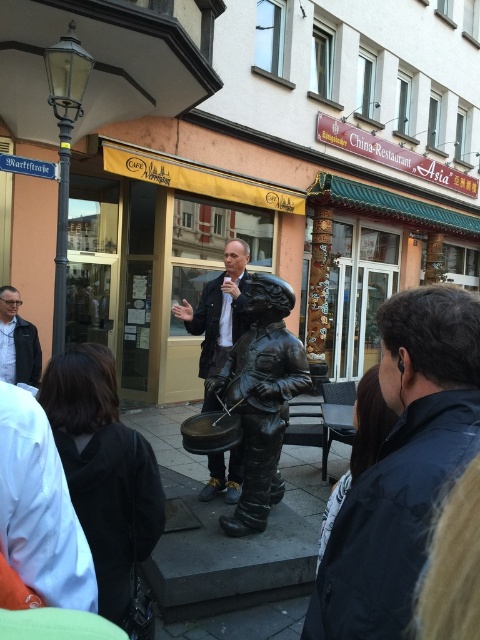
Question: Can you confirm if black fabric at lower left is positioned above matte black jacket at left?

Choices:
 (A) yes
 (B) no

Answer: (B)

Question: Which object is the closest to the black fabric at lower left?

Choices:
 (A) matte black jacket at left
 (B) black stone statue at center
 (C) bronze statue at center

Answer: (B)

Question: Is black fabric at lower left above bronze statue at center?

Choices:
 (A) no
 (B) yes

Answer: (A)

Question: Is bronze statue at center below matte black jacket at center?

Choices:
 (A) no
 (B) yes

Answer: (B)

Question: Estimate the real-world distances between objects in this image. Which object is closer to the bronze statue at center?

Choices:
 (A) black fabric at lower left
 (B) matte black jacket at center
 (C) black stone statue at center
 (D) matte black jacket at left

Answer: (B)

Question: Estimate the real-world distances between objects in this image. Which object is farther from the matte black jacket at center?

Choices:
 (A) black fabric at lower left
 (B) matte black jacket at left
 (C) bronze statue at center
 (D) black stone statue at center

Answer: (A)